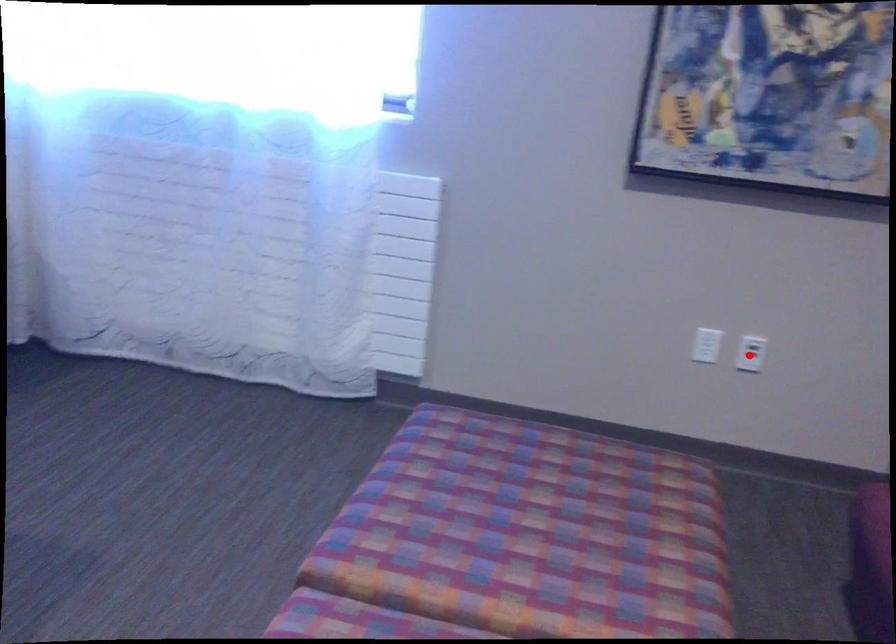
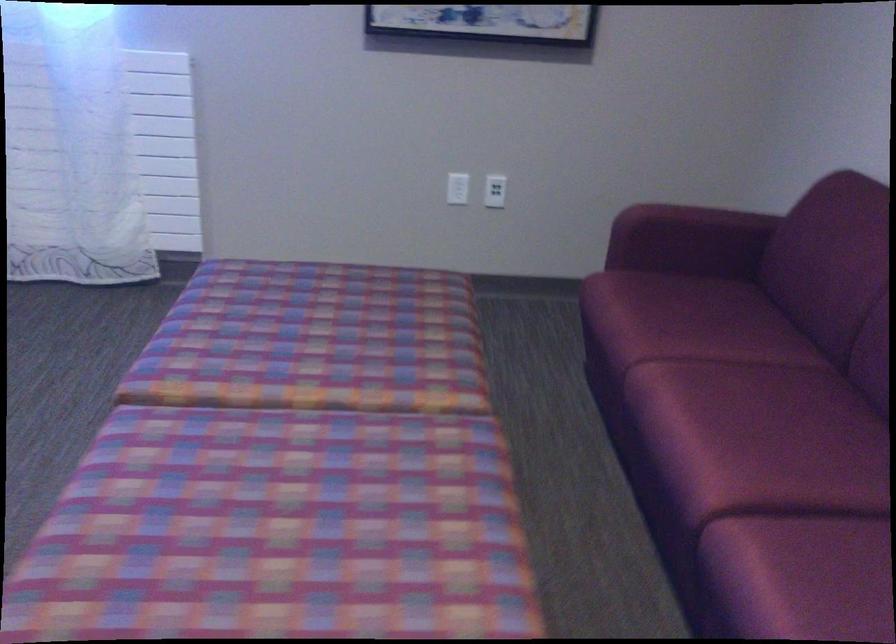
Question: I am providing you with two images of the same scene from different viewpoints. In image1, a red point is highlighted. Considering the same 3D point in image2, which of the following is correct?

Choices:
 (A) It is closer
 (B) It is farther

Answer: (B)